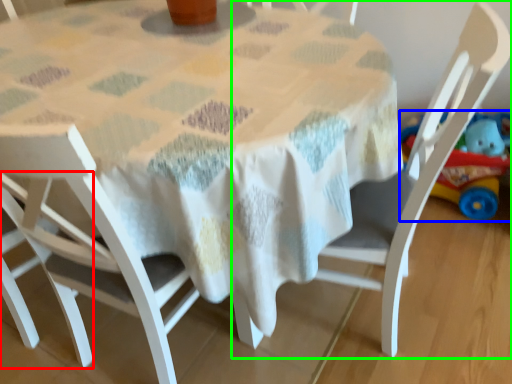
Question: Considering the real-world distances, which object is farthest from chair (highlighted by a red box)? toy (highlighted by a blue box) or chair (highlighted by a green box)?

Choices:
 (A) toy
 (B) chair

Answer: (A)